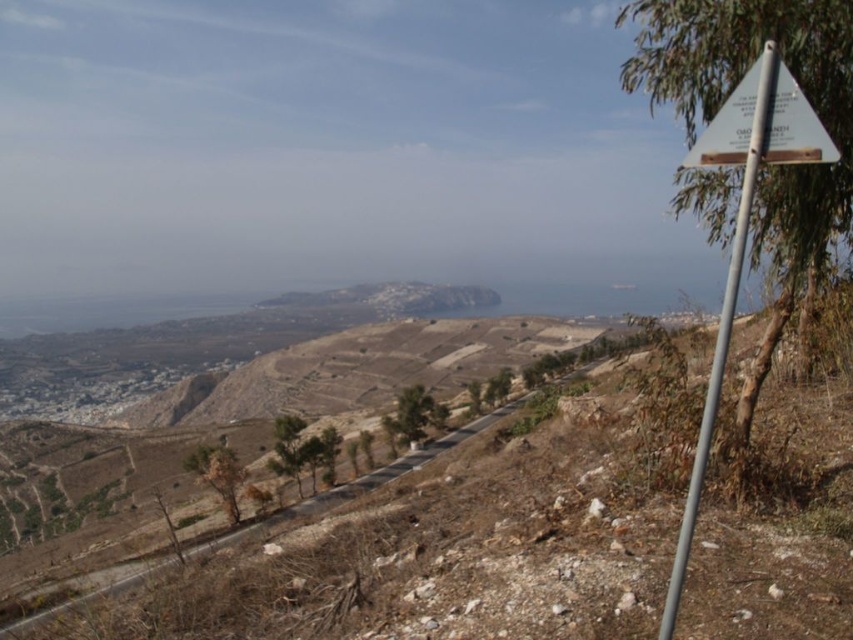
You are standing at the base of the slope and want to reach the white plastic sign at upper right. The path is narrow. If your backpack is 1.2 meters wide, can you pass through the narrowest part of the path?

The distance between you and the white plastic sign at upper right is 3.48 meters, but the question is about the width of the path. Since the provided information does not specify the width of the path, it is impossible to determine if the backpack can pass through.

You are a hiker trying to read the silver metallic signpost at right but find it difficult due to the angle. You notice the white plastic sign at upper right. Which sign is higher up in the image?

The white plastic sign at upper right is positioned over the silver metallic signpost at right, so it is higher up.